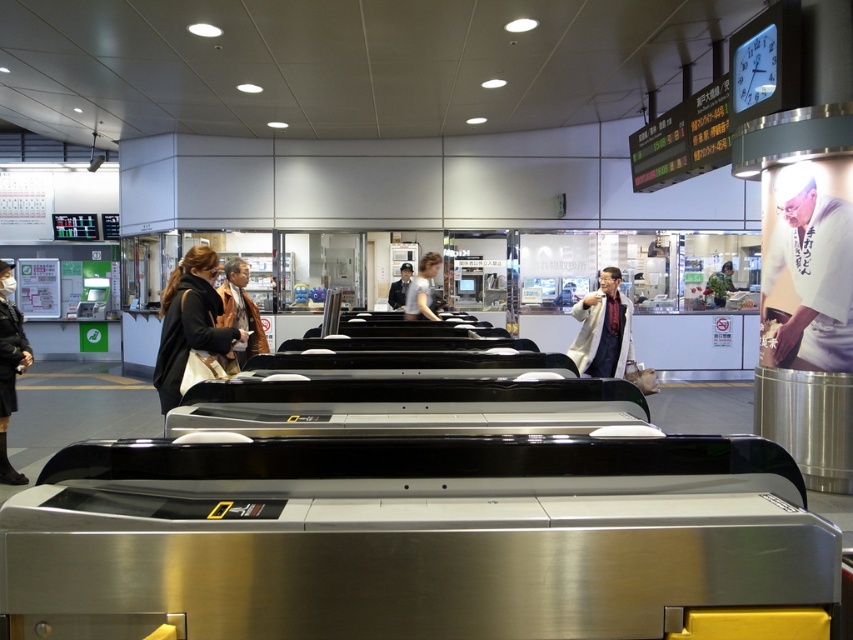
Which is more to the left, matte black jacket at left or dark blue suit at center?

matte black jacket at left

Which is below, matte black jacket at left or dark blue suit at center?

matte black jacket at left is below.

Does point (1, 266) come behind point (396, 285)?

No, (1, 266) is in front of (396, 285).

Identify the location of matte black jacket at left. (9, 368).

Based on the photo, is matte black jacket at left wider than brown leather jacket at center?

No.

Which is behind, point (7, 392) or point (242, 346)?

The point (242, 346) is more distant.

Is point (7, 483) positioned in front of point (238, 257)?

That is True.

The image size is (853, 640). In order to click on matte black jacket at left in this screenshot , I will do `click(9, 368)`.

Can you confirm if white matte jacket at center is wider than matte black jacket at center?

Correct, the width of white matte jacket at center exceeds that of matte black jacket at center.

Between white matte jacket at center and matte black jacket at center, which one appears on the left side from the viewer's perspective?

matte black jacket at center is more to the left.

Which is behind, point (577, 353) or point (426, 296)?

The point (426, 296) is more distant.

This screenshot has height=640, width=853. I want to click on white matte jacket at center, so click(602, 330).